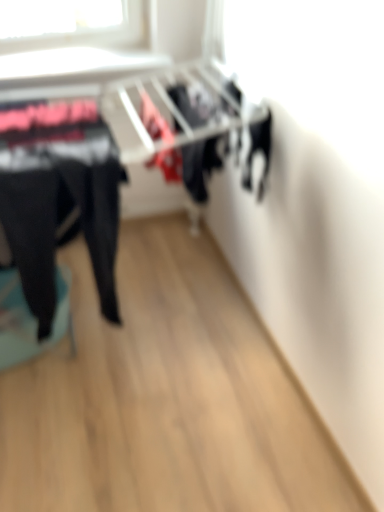
Question: From the image's perspective, is black fabric pants at left located above or below matte black stool at left?

Choices:
 (A) below
 (B) above

Answer: (B)

Question: Is point (86, 228) closer or farther from the camera than point (57, 336)?

Choices:
 (A) closer
 (B) farther

Answer: (A)

Question: Looking at their shapes, would you say black fabric pants at left is wider or thinner than matte black stool at left?

Choices:
 (A) thin
 (B) wide

Answer: (A)

Question: Is point (33, 331) positioned closer to the camera than point (23, 143)?

Choices:
 (A) closer
 (B) farther

Answer: (B)

Question: Is matte black stool at left spatially inside black fabric pants at left, or outside of it?

Choices:
 (A) inside
 (B) outside

Answer: (B)

Question: In the image, is matte black stool at left on the left side or the right side of black fabric pants at left?

Choices:
 (A) right
 (B) left

Answer: (B)

Question: Is matte black stool at left in front of or behind black fabric pants at left in the image?

Choices:
 (A) behind
 (B) front

Answer: (A)